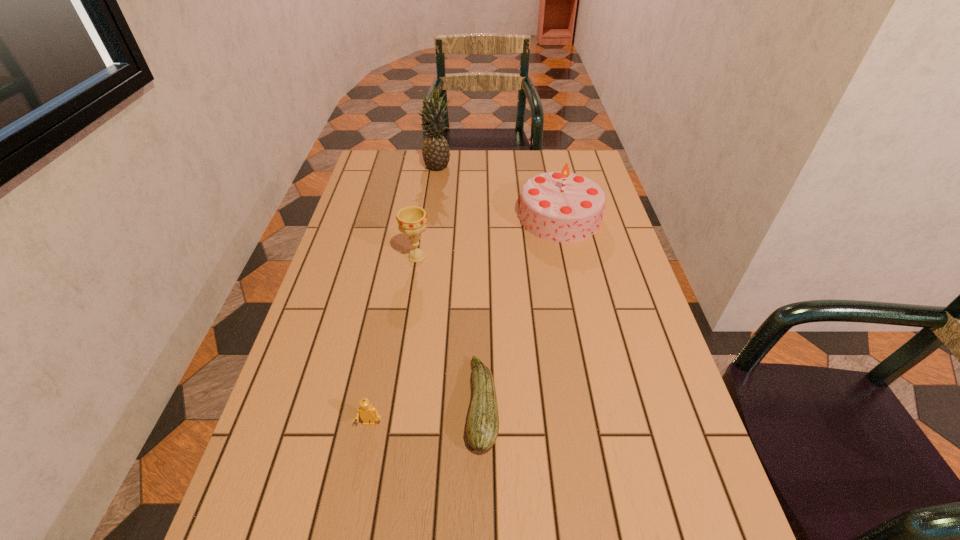
This screenshot has width=960, height=540. In order to click on free space at the right edge of the desktop in this screenshot , I will do `click(620, 444)`.

Where is `free space at the far right corner of the desktop`? The height and width of the screenshot is (540, 960). free space at the far right corner of the desktop is located at coordinates (578, 153).

Find the location of a particular element. Image resolution: width=960 pixels, height=540 pixels. vacant area between the Lego and the chalice is located at coordinates (394, 340).

At what (x,y) coordinates should I click in order to perform the action: click on free point between the second shortest object and the third shortest object. Please return your answer as a coordinate pair (x, y). The width and height of the screenshot is (960, 540). Looking at the image, I should click on (394, 340).

Locate an element on the screen. free space that is in between the pineapple and the birthday cake is located at coordinates (499, 191).

Identify the location of free space that is in between the rightmost object and the fourth tallest object. (465, 320).

Find the location of a particular element. free space that is in between the shortest object and the fourth tallest object is located at coordinates (426, 414).

Image resolution: width=960 pixels, height=540 pixels. Find the location of `vacant space in between the tallest object and the Lego`. vacant space in between the tallest object and the Lego is located at coordinates (404, 294).

Find the location of `vacant region between the shortest object and the rightmost object`. vacant region between the shortest object and the rightmost object is located at coordinates (521, 311).

The width and height of the screenshot is (960, 540). In order to click on free area in between the third farthest object and the zucchini in this screenshot , I will do `click(449, 331)`.